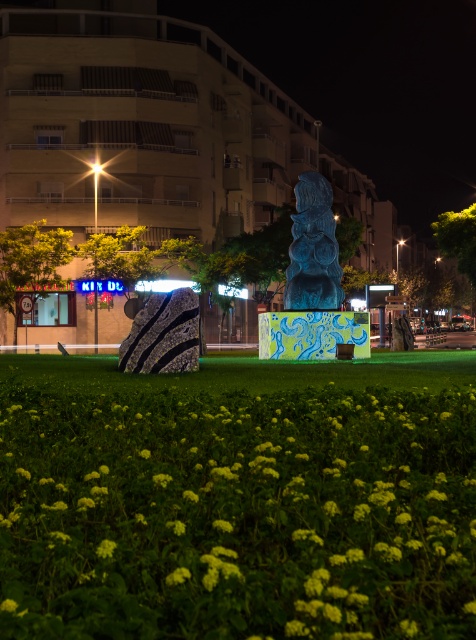
You are a photographer setting up a tripod to capture the blue glossy statue at center and the yellow matte flowers at center. You want to ensure both are in focus. Given that the flowers are closer to the camera, should you adjust the focus to be closer or farther away to include both?

The yellow matte flowers at center is not as tall as the blue glossy statue at center, so adjusting the focus to be farther away would help include both the closer flowers and the taller statue in focus.

Based on the photo, you are a photographer setting up a tripod to capture the mermaid sculpture and the flowers. You want to ensure that both the yellow matte flowers at center and the green matte flower at lower center are visible in the frame. Based on their positions, which flower is closer to the camera?

The green matte flower at lower center is closer to the camera because the yellow matte flowers at center is positioned under it, meaning the green one is in front.

You are standing at the point marked by the coordinates [237,515] in the image. Looking around, you see the yellow matte flowers at center and the mermaid sculpture. Which object is closer to your current position?

The yellow matte flowers at center are exactly at the point [237,515], so you are already standing among them. The mermaid sculpture is located to the left of this position, meaning it is farther away from your current location.